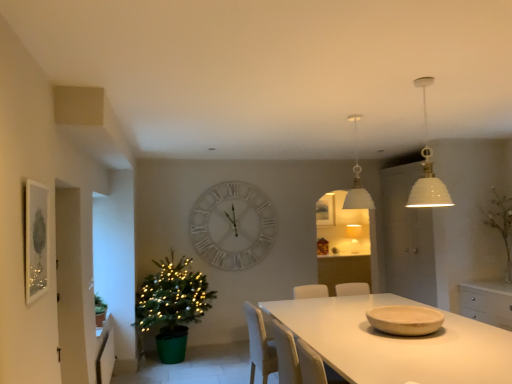
You are a GUI agent. You are given a task and a screenshot of the screen. Output one action in this format:
    pyautogui.click(x=<x>, y=<y>)
    Task: Click on the empty space that is ontop of white ceramic lampshade at upper right, the 2th lamp when ordered from back to front
    Image resolution: width=512 pixels, height=384 pixels.
    Given the screenshot: What is the action you would take?
    pyautogui.click(x=421, y=84)